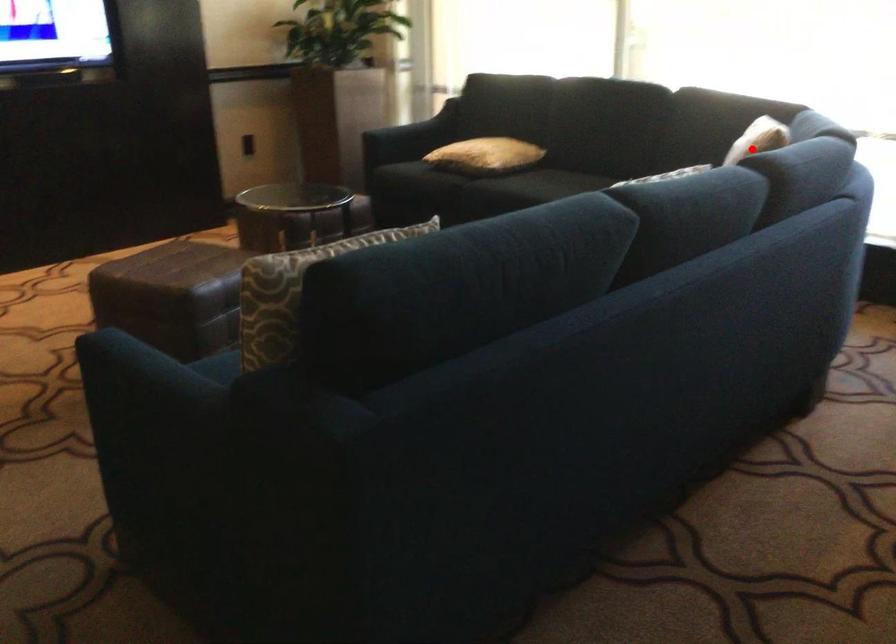
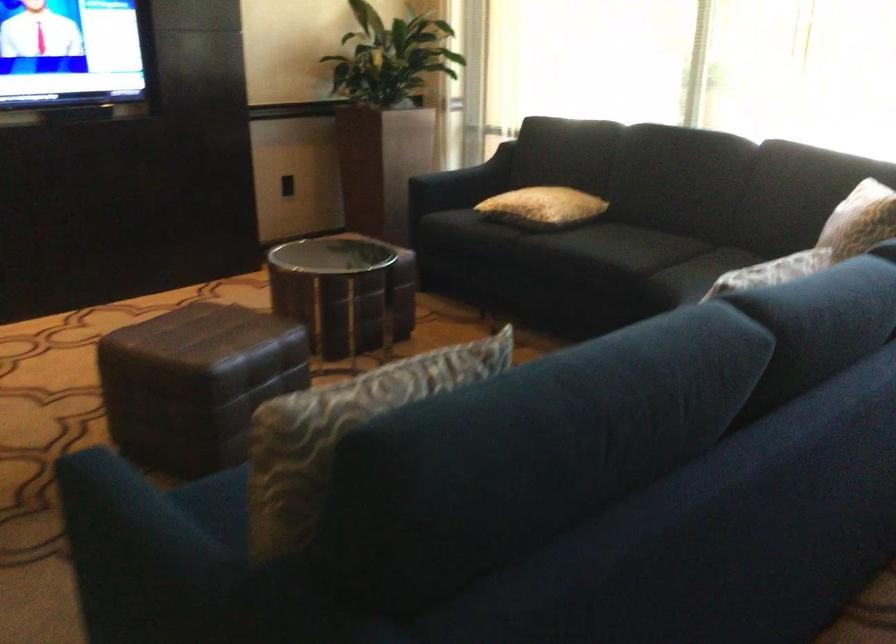
In the second image, find the point that corresponds to the highlighted location in the first image.

(859, 220)